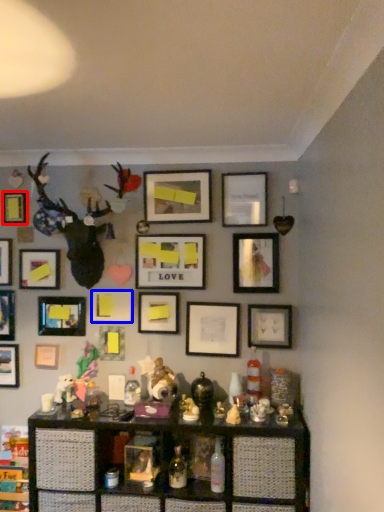
Question: Which of the following is the farthest to the observer, picture frame (highlighted by a red box) or picture frame (highlighted by a blue box)?

Choices:
 (A) picture frame
 (B) picture frame

Answer: (A)